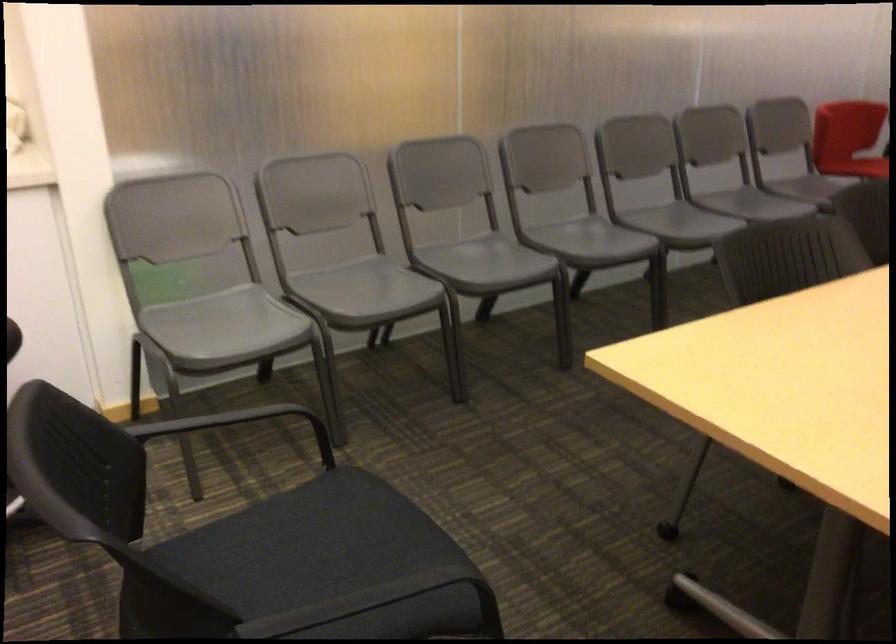
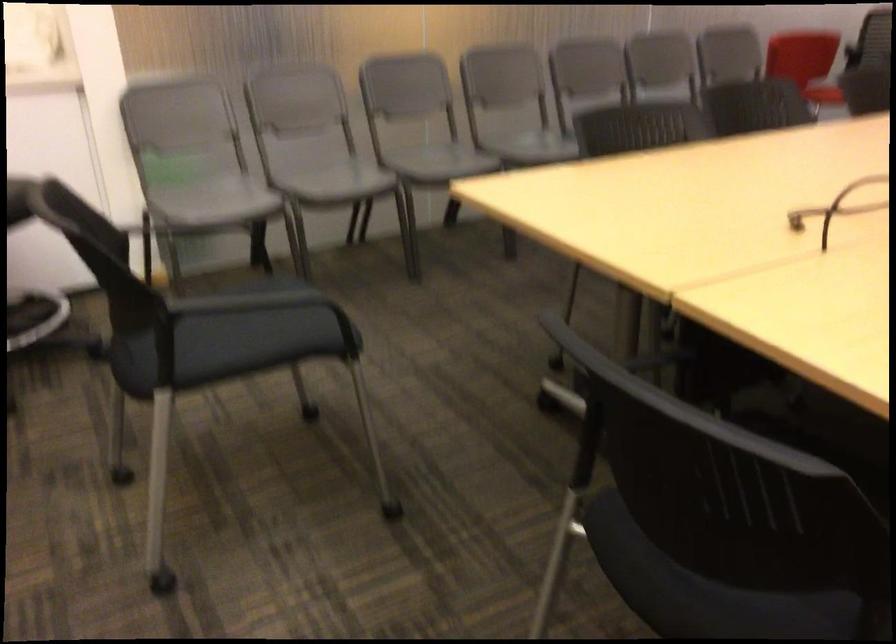
Find the pixel in the second image that matches [487,267] in the first image.

(436, 161)